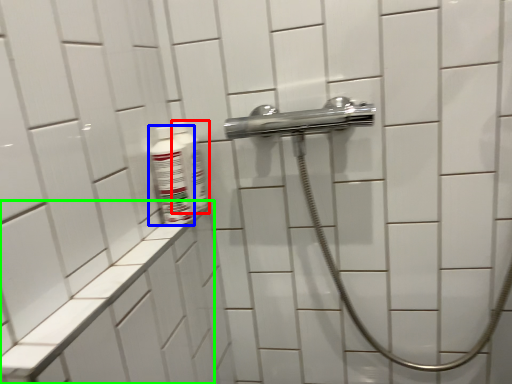
Question: Considering the real-world distances, which object is closest to mouthwash (highlighted by a red box)? mouthwash (highlighted by a blue box) or ledge (highlighted by a green box).

Choices:
 (A) mouthwash
 (B) ledge

Answer: (A)